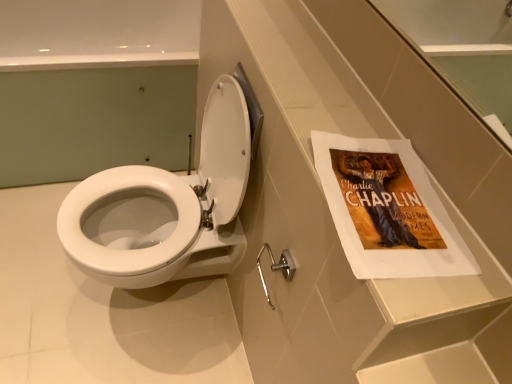
Locate an element on the screen. Image resolution: width=512 pixels, height=384 pixels. white glossy toilet at center is located at coordinates (95, 86).

Measure the distance between point (x=181, y=210) and camera.

Answer: They are 1.24 meters apart.

You are a GUI agent. You are given a task and a screenshot of the screen. Output one action in this format:
    pyautogui.click(x=<x>, y=<y>)
    Task: Click on the silver metallic towel bar at lower center
    The width and height of the screenshot is (512, 384).
    Given the screenshot: What is the action you would take?
    pyautogui.click(x=277, y=267)

In the image, there is a white glossy toilet at center. Find the location of `bath above it (from the image's perspective)`. bath above it (from the image's perspective) is located at coordinates (95, 86).

From the image's perspective, is white glossy toilet at center over white glossy toilet at center?

Yes, from the image's perspective, white glossy toilet at center is above white glossy toilet at center.

Considering the sizes of objects white glossy toilet at center and white glossy toilet at center in the image provided, who is smaller, white glossy toilet at center or white glossy toilet at center?

Smaller between the two is white glossy toilet at center.

Can you tell me how much white glossy toilet at center and white glossy toilet at center differ in facing direction?

The facing directions of white glossy toilet at center and white glossy toilet at center are 90 degrees apart.

Between silver metallic towel bar at lower center and white glossy toilet at center, which one has larger size?

white glossy toilet at center is bigger.

Consider the image. Which is closer, (x=259, y=259) or (x=151, y=67)?

Point (x=259, y=259) appears to be closer to the viewer than point (x=151, y=67).

Can you tell me how much silver metallic towel bar at lower center and white glossy toilet at center differ in facing direction?

silver metallic towel bar at lower center and white glossy toilet at center are facing 89 degrees away from each other.

Locate an element on the screen. towel bar located above the white glossy toilet at center (from a real-world perspective) is located at coordinates (277, 267).

From the image's perspective, is silver metallic towel bar at lower center above or below white glossy toilet at center?

silver metallic towel bar at lower center is below white glossy toilet at center.

Measure the distance between silver metallic towel bar at lower center and white glossy toilet at center.

14.82 inches.

Which of these two, silver metallic towel bar at lower center or white glossy toilet at center, is wider?

With larger width is white glossy toilet at center.

Can you confirm if silver metallic towel bar at lower center is positioned to the left of white glossy toilet at center?

In fact, silver metallic towel bar at lower center is to the right of white glossy toilet at center.

From a real-world perspective, is white glossy toilet at center over silver metallic towel bar at lower center?

No.

Between white glossy toilet at center and silver metallic towel bar at lower center, which one is positioned behind?

white glossy toilet at center is further from the camera.

Consider the image. Does white glossy toilet at center have a lesser width compared to silver metallic towel bar at lower center?

Incorrect, the width of white glossy toilet at center is not less than that of silver metallic towel bar at lower center.

Between white glossy toilet at center and white glossy toilet at center, which one appears on the right side from the viewer's perspective?

white glossy toilet at center.

Considering their positions, is white glossy toilet at center located in front of or behind white glossy toilet at center?

Visually, white glossy toilet at center is located in front of white glossy toilet at center.

From the image's perspective, is white glossy toilet at center beneath white glossy toilet at center?

Yes.

Who is smaller, white glossy toilet at center or white glossy toilet at center?

With smaller size is white glossy toilet at center.

Does point (155, 219) appear closer or farther from the camera than point (287, 262)?

Point (155, 219) is farther from the camera than point (287, 262).

How different are the orientations of white glossy toilet at center and silver metallic towel bar at lower center in degrees?

The angle between the facing direction of white glossy toilet at center and the facing direction of silver metallic towel bar at lower center is 0.954 degrees.

Is white glossy toilet at center wider than silver metallic towel bar at lower center?

Yes, white glossy toilet at center is wider than silver metallic towel bar at lower center.

Is there a large distance between white glossy toilet at center and silver metallic towel bar at lower center?

They are positioned close to each other.

Locate an element on the screen. The image size is (512, 384). toilet below the white glossy toilet at center (from the image's perspective) is located at coordinates (166, 208).

Identify the location of towel bar above the white glossy toilet at center (from a real-world perspective). (277, 267).

Considering their positions, is white glossy toilet at center positioned closer to silver metallic towel bar at lower center than white glossy toilet at center?

white glossy toilet at center is closer to silver metallic towel bar at lower center.

From the image, which object appears to be nearer to white glossy toilet at center, white glossy toilet at center or silver metallic towel bar at lower center?

The object closer to white glossy toilet at center is silver metallic towel bar at lower center.

Based on their spatial positions, is silver metallic towel bar at lower center or white glossy toilet at center further from white glossy toilet at center?

The object further to white glossy toilet at center is white glossy toilet at center.

Based on their spatial positions, is silver metallic towel bar at lower center or white glossy toilet at center further from white glossy toilet at center?

silver metallic towel bar at lower center lies further to white glossy toilet at center than the other object.

Which object lies nearer to the anchor point silver metallic towel bar at lower center, white glossy toilet at center or white glossy toilet at center?

The object closer to silver metallic towel bar at lower center is white glossy toilet at center.

Considering their positions, is white glossy toilet at center positioned further to white glossy toilet at center than silver metallic towel bar at lower center?

Among the two, silver metallic towel bar at lower center is located further to white glossy toilet at center.

Identify the location of toilet between white glossy toilet at center and silver metallic towel bar at lower center in the up-down direction. Image resolution: width=512 pixels, height=384 pixels. (166, 208).